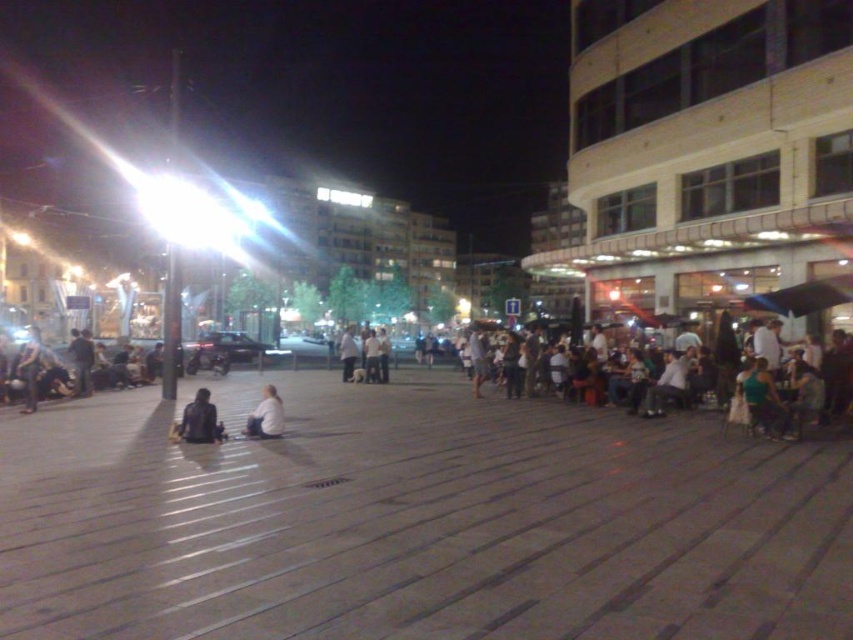
You are a photographer standing in the plaza and want to capture both the dark blue jacket at lower left and the white matte shirt at lower center in the same frame. Which object should you focus on first to ensure both are in focus?

You should focus on the dark blue jacket at lower left first because it is larger than the white matte shirt at lower center, so focusing on the larger object will help ensure both are in focus.

You are a photographer planning to take a group photo of the dark blue jacket at lower left and the white matte shirt at lower center. The camera you have can only focus on objects within a 2 meter width. Given their widths, will both fit within the camera focus area?

The dark blue jacket at lower left is wider than the white matte shirt at lower center. However, the camera can focus on objects within a 2 meter width. Since the combined width of both objects is not specified, we cannot determine if they will fit. Please provide more details.

You are a delivery person holding a package that needs to be placed between the dark blue jacket at lower left and the white matte shirt at lower center. The package is 30 inches long. Can you fit it between them without moving either clothing item?

The distance between the dark blue jacket at lower left and the white matte shirt at lower center is 34.24 inches. Since the package is 30 inches long, it can fit between them as there is enough space.